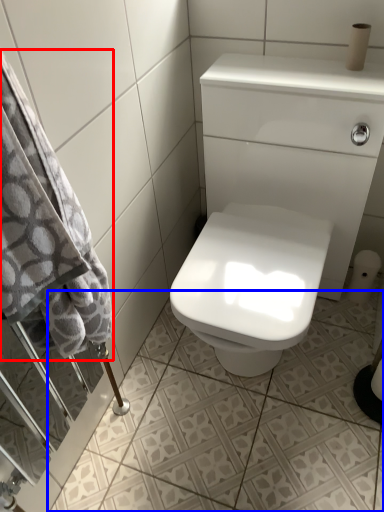
Question: Which object is closer to the camera taking this photo, bath towel (highlighted by a red box) or ceramic tile (highlighted by a blue box)?

Choices:
 (A) bath towel
 (B) ceramic tile

Answer: (A)